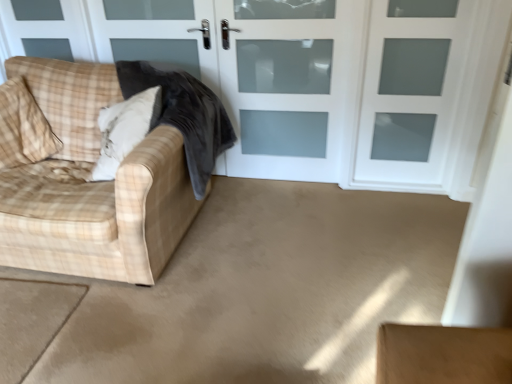
The image size is (512, 384). Describe the element at coordinates (125, 129) in the screenshot. I see `plush white pillow at left, the second pillow from the left` at that location.

Locate an element on the screen. The image size is (512, 384). plush white pillow at left, which is the first pillow in right-to-left order is located at coordinates (125, 129).

What is the approximate width of plaid fabric couch at left?

It is 1.04 meters.

What do you see at coordinates (264, 290) in the screenshot? Image resolution: width=512 pixels, height=384 pixels. I see `beige carpet at lower left` at bounding box center [264, 290].

Locate an element on the screen. The height and width of the screenshot is (384, 512). velvet dark gray blanket at left is located at coordinates (184, 115).

Image resolution: width=512 pixels, height=384 pixels. What do you see at coordinates (228, 66) in the screenshot?
I see `white matte door at center` at bounding box center [228, 66].

The height and width of the screenshot is (384, 512). What do you see at coordinates (406, 93) in the screenshot?
I see `white frosted glass screen door at upper center, which is counted as the 1th screen door, starting from the right` at bounding box center [406, 93].

Locate an element on the screen. plush white pillow at left, which is the first pillow in right-to-left order is located at coordinates (125, 129).

From a real-world perspective, between velvet dark gray blanket at left and plush white pillow at left, the second pillow from the left, who is vertically higher?

From a 3D spatial view, plush white pillow at left, the second pillow from the left, is above.

From the image's perspective, between velvet dark gray blanket at left and plush white pillow at left, which is the first pillow in right-to-left order, who is located below?

plush white pillow at left, which is the first pillow in right-to-left order, is shown below in the image.

Is velvet dark gray blanket at left to the left of plush white pillow at left, the second pillow from the left, from the viewer's perspective?

No, velvet dark gray blanket at left is not to the left of plush white pillow at left, the second pillow from the left.

Is beige fabric pillow at left, the 1th pillow positioned from the left, oriented towards white frosted glass screen door at upper center, which is counted as the 1th screen door, starting from the right?

No, beige fabric pillow at left, the 1th pillow positioned from the left, is not aimed at white frosted glass screen door at upper center, which is counted as the 1th screen door, starting from the right.

Is beige fabric pillow at left, the second pillow when ordered from right to left, not near white frosted glass screen door at upper center, placed as the 2th screen door when sorted from left to right?

A: Indeed, beige fabric pillow at left, the second pillow when ordered from right to left, is not near white frosted glass screen door at upper center, placed as the 2th screen door when sorted from left to right.

Is white frosted glass screen door at upper center, which is counted as the 1th screen door, starting from the right, located within beige fabric pillow at left, the second pillow when ordered from right to left?

No, white frosted glass screen door at upper center, which is counted as the 1th screen door, starting from the right, is not surrounded by beige fabric pillow at left, the second pillow when ordered from right to left.

From the image's perspective, is plush white pillow at left, which is the first pillow in right-to-left order, below plaid fabric couch at left?

No.

This screenshot has width=512, height=384. Find the location of `pillow that is the 1st object located behind the plaid fabric couch at left`. pillow that is the 1st object located behind the plaid fabric couch at left is located at coordinates (125, 129).

Between plush white pillow at left, which is the first pillow in right-to-left order, and plaid fabric couch at left, which one has less height?

Standing shorter between the two is plush white pillow at left, which is the first pillow in right-to-left order.

Do you think plush white pillow at left, the second pillow from the left, is within white matte door at center, or outside of it?

plush white pillow at left, the second pillow from the left, is not inside white matte door at center, it's outside.

Consider the image. Between plush white pillow at left, the second pillow from the left, and white matte door at center, which one is positioned behind?

white matte door at center is further from the camera.

Looking at their sizes, would you say plush white pillow at left, the second pillow from the left, is wider or thinner than white matte door at center?

In the image, plush white pillow at left, the second pillow from the left, appears to be wider than white matte door at center.

Consider the image. Can you tell me how much plush white pillow at left, the second pillow from the left, and white matte door at center differ in facing direction?

plush white pillow at left, the second pillow from the left, and white matte door at center are facing 1.06 degrees away from each other.

Who is taller, beige fabric pillow at left, the second pillow when ordered from right to left, or plaid fabric couch at left?

plaid fabric couch at left.

How distant is beige fabric pillow at left, the second pillow when ordered from right to left, from plaid fabric couch at left?

They are 13.34 inches apart.

From a real-world perspective, is beige fabric pillow at left, the second pillow when ordered from right to left, physically above plaid fabric couch at left?

Yes.

Are beige fabric pillow at left, the second pillow when ordered from right to left, and plaid fabric couch at left making contact?

No, beige fabric pillow at left, the second pillow when ordered from right to left, is not next to plaid fabric couch at left.

Which is farther, (423, 70) or (433, 272)?

Point (423, 70)

Considering the positions of objects white frosted glass screen door at upper center, which is counted as the 1th screen door, starting from the right, and beige carpet at lower left in the image provided, who is behind, white frosted glass screen door at upper center, which is counted as the 1th screen door, starting from the right, or beige carpet at lower left?

white frosted glass screen door at upper center, which is counted as the 1th screen door, starting from the right, is more distant.

What's the angular difference between white frosted glass screen door at upper center, placed as the 2th screen door when sorted from left to right, and beige carpet at lower left's facing directions?

0.111 degrees separate the facing orientations of white frosted glass screen door at upper center, placed as the 2th screen door when sorted from left to right, and beige carpet at lower left.

Is white matte door at center bigger or smaller than plaid fabric couch at left?

Clearly, white matte door at center is smaller in size than plaid fabric couch at left.

Where is `studio couch lying in front of the white matte door at center`? This screenshot has width=512, height=384. studio couch lying in front of the white matte door at center is located at coordinates (103, 216).

Is white matte door at center thinner than plaid fabric couch at left?

Indeed, white matte door at center has a lesser width compared to plaid fabric couch at left.

From the image's perspective, count 2nd pillows downward from the velvet dark gray blanket at left and point to it. Please provide its 2D coordinates.

[(125, 129)]

I want to click on the 2nd pillow positioned above the white frosted glass screen door at upper center, placed as the 2th screen door when sorted from left to right (from a real-world perspective), so click(x=23, y=127).

Considering their positions, is plush white pillow at left, which is the first pillow in right-to-left order, positioned closer to white frosted glass door at center, marked as the 2th screen door in a right-to-left arrangement, than white matte door at center?

Based on the image, white matte door at center appears to be nearer to white frosted glass door at center, marked as the 2th screen door in a right-to-left arrangement.

Based on their spatial positions, is velvet dark gray blanket at left or white frosted glass screen door at upper center, placed as the 2th screen door when sorted from left to right, further from plush white pillow at left, the second pillow from the left?

Among the two, white frosted glass screen door at upper center, placed as the 2th screen door when sorted from left to right, is located further to plush white pillow at left, the second pillow from the left.

Which object lies further to the anchor point beige fabric pillow at left, the second pillow when ordered from right to left, velvet dark gray blanket at left or plush white pillow at left, the second pillow from the left?

velvet dark gray blanket at left lies further to beige fabric pillow at left, the second pillow when ordered from right to left, than the other object.

Looking at the image, which one is located further to beige fabric pillow at left, the 1th pillow positioned from the left, plush white pillow at left, the second pillow from the left, or beige carpet at lower left?

beige carpet at lower left is positioned further to the anchor beige fabric pillow at left, the 1th pillow positioned from the left.

Based on their spatial positions, is white matte door at center or beige carpet at lower left further from white frosted glass screen door at upper center, placed as the 2th screen door when sorted from left to right?

Based on the image, beige carpet at lower left appears to be further to white frosted glass screen door at upper center, placed as the 2th screen door when sorted from left to right.

From the image, which object appears to be farther from white matte door at center, white frosted glass screen door at upper center, placed as the 2th screen door when sorted from left to right, or beige fabric pillow at left, the 1th pillow positioned from the left?

beige fabric pillow at left, the 1th pillow positioned from the left, is further to white matte door at center.

Based on their spatial positions, is white frosted glass screen door at upper center, which is counted as the 1th screen door, starting from the right, or plaid fabric couch at left further from plush white pillow at left, which is the first pillow in right-to-left order?

The object further to plush white pillow at left, which is the first pillow in right-to-left order, is white frosted glass screen door at upper center, which is counted as the 1th screen door, starting from the right.

Which object lies nearer to the anchor point white matte door at center, plush white pillow at left, which is the first pillow in right-to-left order, or white frosted glass door at center, which ranks as the first screen door in left-to-right order?

white frosted glass door at center, which ranks as the first screen door in left-to-right order.

You are a GUI agent. You are given a task and a screenshot of the screen. Output one action in this format:
    pyautogui.click(x=<x>, y=<y>)
    Task: Click on the studio couch between beige fabric pillow at left, the 1th pillow positioned from the left, and white matte door at center
    
    Given the screenshot: What is the action you would take?
    point(103,216)

This screenshot has width=512, height=384. Identify the location of concrete between plush white pillow at left, which is the first pillow in right-to-left order, and white frosted glass screen door at upper center, which is counted as the 1th screen door, starting from the right, in the horizontal direction. (264, 290).

This screenshot has width=512, height=384. I want to click on pillow between beige fabric pillow at left, the 1th pillow positioned from the left, and white frosted glass screen door at upper center, which is counted as the 1th screen door, starting from the right, so pos(125,129).

Find the location of `blanket between beige carpet at lower left and white frosted glass door at center, which ranks as the first screen door in left-to-right order, from front to back`. blanket between beige carpet at lower left and white frosted glass door at center, which ranks as the first screen door in left-to-right order, from front to back is located at coordinates (184, 115).